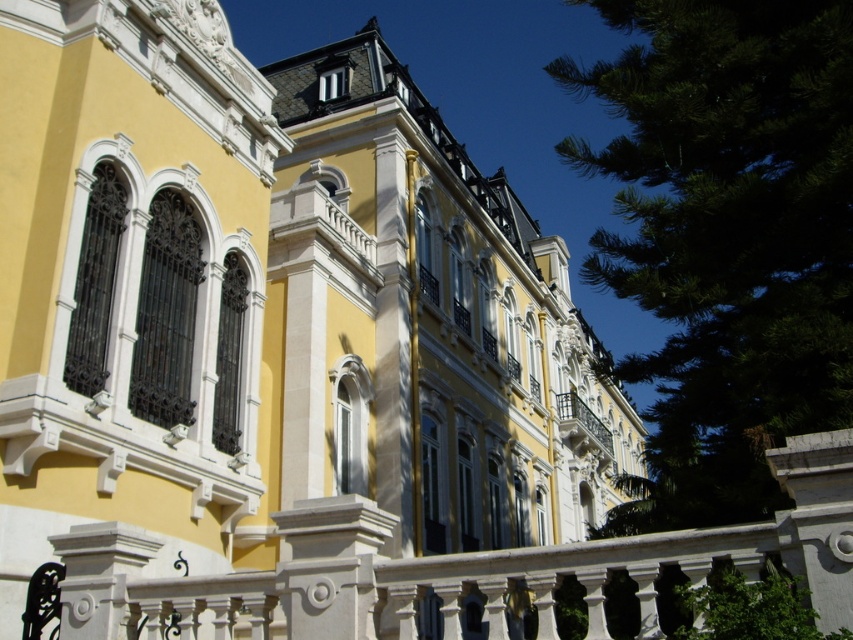
You are standing in front of the grand building and want to take a photo of both the green leafy tree at upper right and the white wrought iron balcony at center. Which object should you focus on first to ensure both are in frame?

You should focus on the green leafy tree at upper right first because it is taller than the white wrought iron balcony at center, so adjusting the camera angle to include its full height will naturally include the balcony as well.

You are standing in front of the grand building and want to take a photo of both the green leafy tree at upper right and the white wrought iron balcony at center. Which object should you adjust your camera focus on first to ensure both are in the frame?

You should focus on the white wrought iron balcony at center first because the green leafy tree at upper right is closer to the viewer, so adjusting focus starting from the closer object ensures both are in the frame.